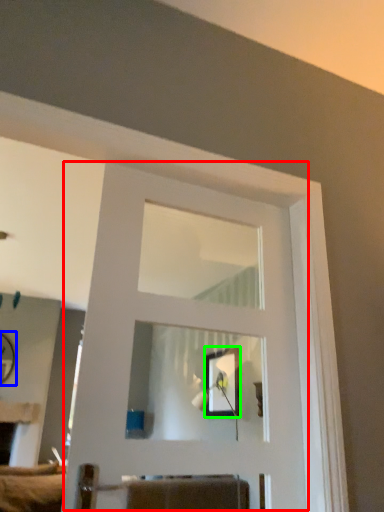
Question: Considering the real-world distances, which object is closest to door (highlighted by a red box)? mirror (highlighted by a blue box) or picture frame (highlighted by a green box).

Choices:
 (A) mirror
 (B) picture frame

Answer: (B)